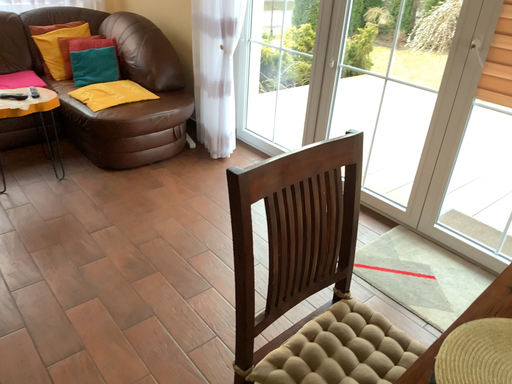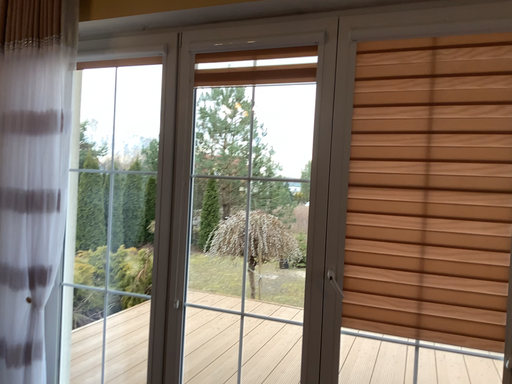
Question: How did the camera likely rotate when shooting the video?

Choices:
 (A) rotated right
 (B) rotated left

Answer: (A)